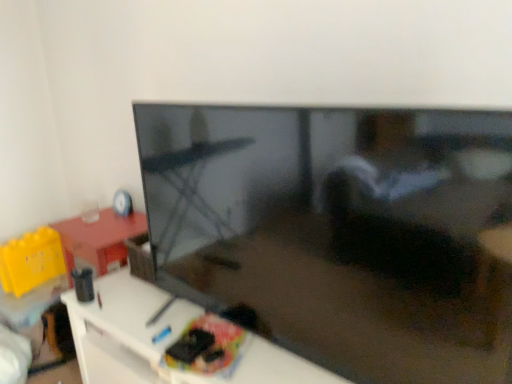
Question: From a real-world perspective, is white glossy tv stand at lower left on top of matte plastic cd at upper left?

Choices:
 (A) yes
 (B) no

Answer: (B)

Question: Can you see white glossy tv stand at lower left touching matte plastic cd at upper left?

Choices:
 (A) yes
 (B) no

Answer: (B)

Question: Does white glossy tv stand at lower left have a smaller size compared to matte plastic cd at upper left?

Choices:
 (A) yes
 (B) no

Answer: (B)

Question: Would you say white glossy tv stand at lower left is a long distance from matte plastic cd at upper left?

Choices:
 (A) yes
 (B) no

Answer: (B)

Question: Is the position of white glossy tv stand at lower left less distant than that of matte plastic cd at upper left?

Choices:
 (A) no
 (B) yes

Answer: (B)

Question: From a real-world perspective, relative to matte plastic cd at upper left, is matte black tv at center vertically above or below?

Choices:
 (A) below
 (B) above

Answer: (B)

Question: Considering the positions of matte black tv at center and matte plastic cd at upper left in the image, is matte black tv at center taller or shorter than matte plastic cd at upper left?

Choices:
 (A) short
 (B) tall

Answer: (B)

Question: Is matte black tv at center to the left or to the right of matte plastic cd at upper left in the image?

Choices:
 (A) right
 (B) left

Answer: (A)

Question: From the image's perspective, is matte black tv at center positioned above or below matte plastic cd at upper left?

Choices:
 (A) below
 (B) above

Answer: (A)

Question: Is point (119, 195) positioned closer to the camera than point (132, 331)?

Choices:
 (A) farther
 (B) closer

Answer: (A)

Question: Considering the positions of matte plastic cd at upper left and white glossy tv stand at lower left in the image, is matte plastic cd at upper left bigger or smaller than white glossy tv stand at lower left?

Choices:
 (A) small
 (B) big

Answer: (A)

Question: From a real-world perspective, is matte plastic cd at upper left physically located above or below white glossy tv stand at lower left?

Choices:
 (A) below
 (B) above

Answer: (B)

Question: Do you think matte plastic cd at upper left is within white glossy tv stand at lower left, or outside of it?

Choices:
 (A) outside
 (B) inside

Answer: (A)

Question: Would you say white glossy tv stand at lower left is inside or outside matte black tv at center?

Choices:
 (A) inside
 (B) outside

Answer: (B)

Question: Would you say white glossy tv stand at lower left is to the left or to the right of matte black tv at center in the picture?

Choices:
 (A) left
 (B) right

Answer: (A)